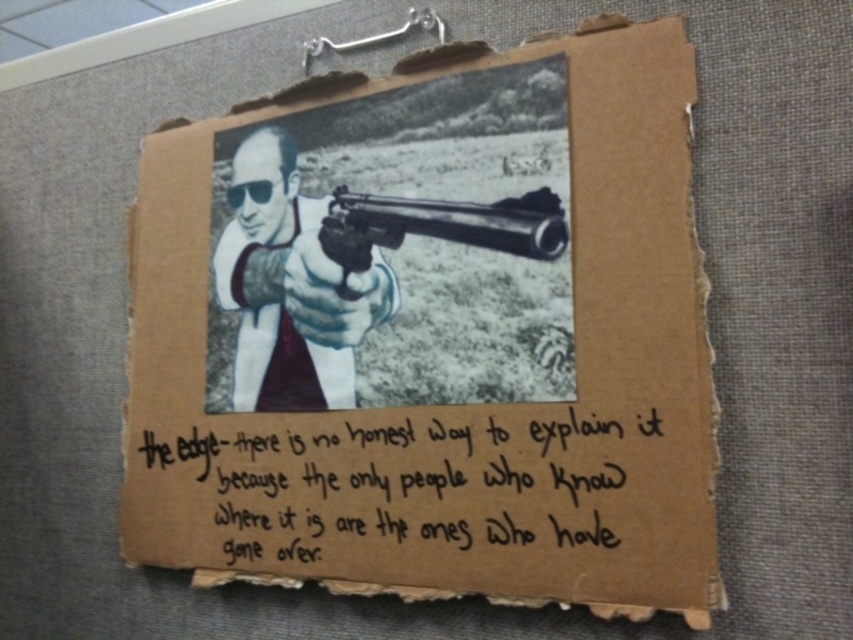
Question: Which of the following is the closest to the observer?

Choices:
 (A) (498, 509)
 (B) (616, 163)

Answer: (B)

Question: Considering the relative positions of black handwritten text at center and white glossy shirt at center in the image provided, where is black handwritten text at center located with respect to white glossy shirt at center?

Choices:
 (A) right
 (B) left

Answer: (A)

Question: Which point appears closest to the camera in this image?

Choices:
 (A) (618, 468)
 (B) (596, 481)
 (C) (364, 202)
 (D) (384, 262)

Answer: (A)

Question: Does black handwritten text at center appear over white glossy shirt at center?

Choices:
 (A) yes
 (B) no

Answer: (B)

Question: Among these objects, which one is farthest from the camera?

Choices:
 (A) brown cardboard at center
 (B) black handwritten text at center
 (C) white glossy shirt at center
 (D) polished silver rifle at center

Answer: (C)

Question: Is white glossy shirt at center smaller than polished silver rifle at center?

Choices:
 (A) yes
 (B) no

Answer: (B)